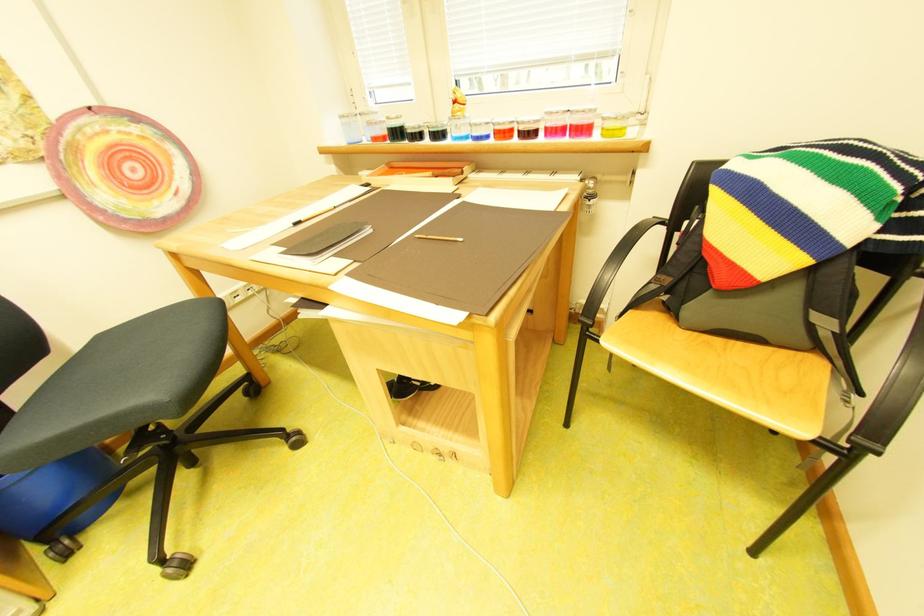
At what (x,y) coordinates should I click in order to perform the action: click on yellow pencil. Please return your answer as a coordinate pair (x, y). Looking at the image, I should click on (439, 238).